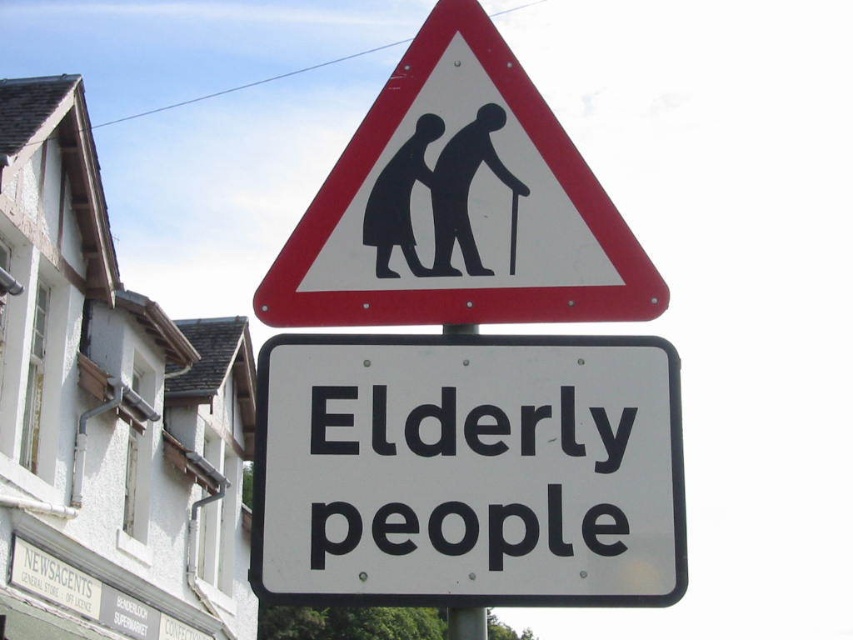
Question: Does white plastic sign at center lie behind black plastic sign at upper center?

Choices:
 (A) yes
 (B) no

Answer: (B)

Question: Which point is farther to the camera?

Choices:
 (A) white plastic sign at center
 (B) black plastic sign at upper center

Answer: (B)

Question: Can you confirm if white plastic sign at center is positioned to the left of black plastic sign at upper center?

Choices:
 (A) no
 (B) yes

Answer: (A)

Question: Which object appears closest to the camera in this image?

Choices:
 (A) white plastic sign at center
 (B) black plastic sign at upper center

Answer: (A)

Question: Is the position of white plastic sign at center more distant than that of black plastic sign at upper center?

Choices:
 (A) yes
 (B) no

Answer: (B)

Question: Which object appears farthest from the camera in this image?

Choices:
 (A) white plastic sign at center
 (B) black plastic sign at upper center

Answer: (B)